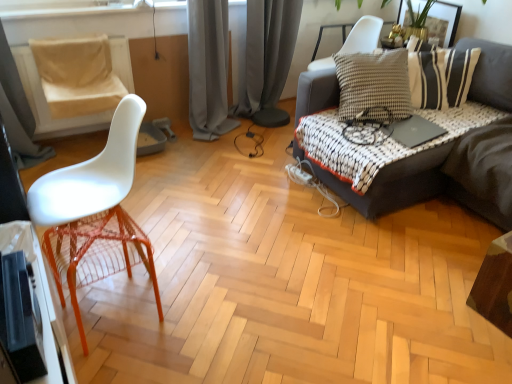
The width and height of the screenshot is (512, 384). What are the coordinates of `free space above beige fabric swivel chair at left (from a real-world perspective)` in the screenshot? It's located at (70, 41).